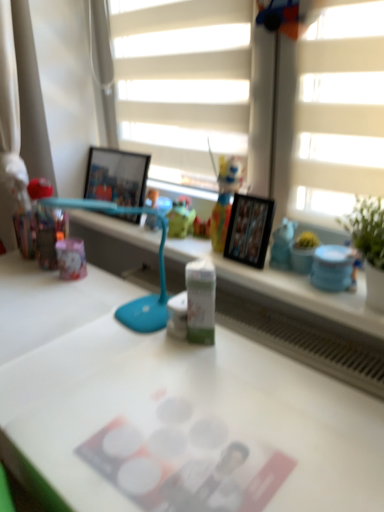
Where is `free area in between teal plastic table lamp at center and green matte milk carton at center, placed as the 2th stationery when sorted from right to left`? The height and width of the screenshot is (512, 384). free area in between teal plastic table lamp at center and green matte milk carton at center, placed as the 2th stationery when sorted from right to left is located at coordinates point(154,349).